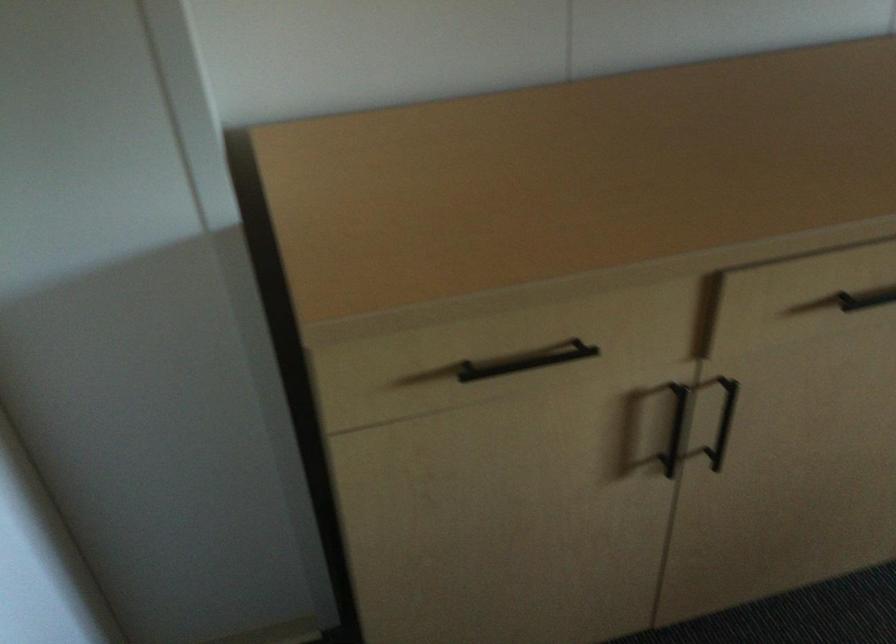
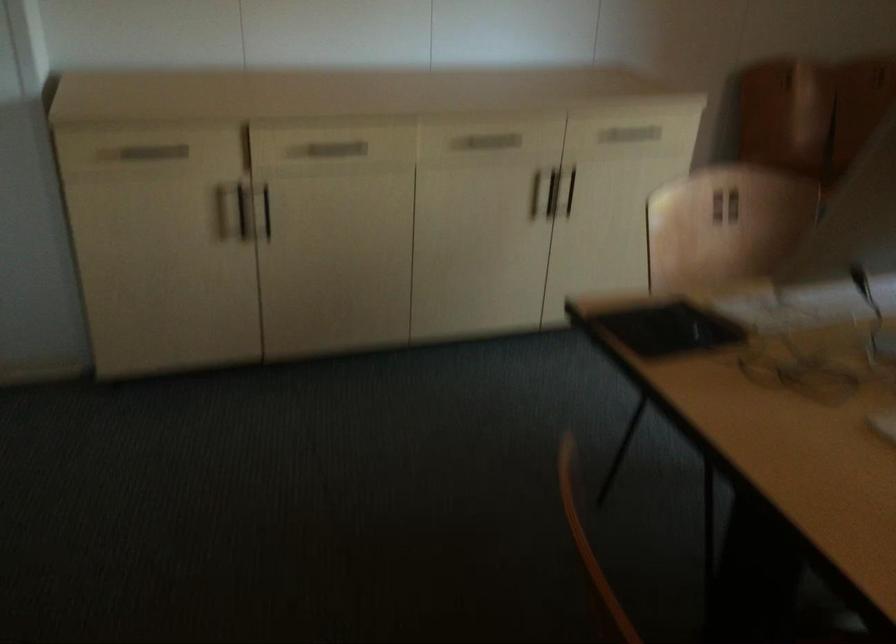
Find the pixel in the second image that matches point 712,413 in the first image.

(264, 211)